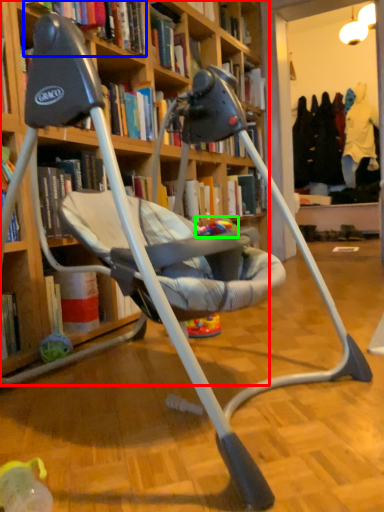
Question: Which object is positioned farthest from bookcase (highlighted by a red box)? Select from book (highlighted by a blue box) and toy (highlighted by a green box).

Choices:
 (A) book
 (B) toy

Answer: (A)